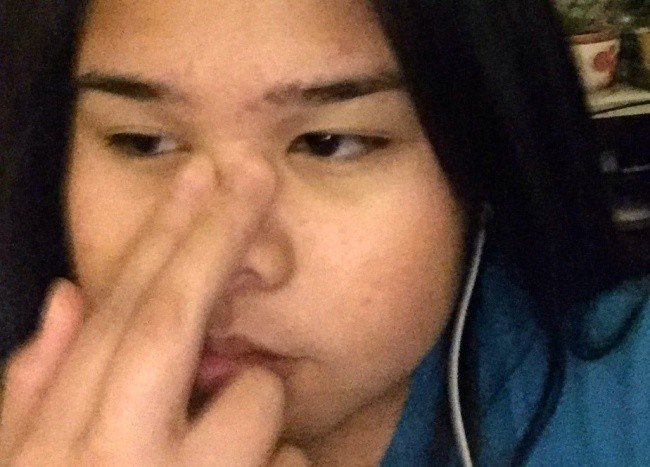
The image size is (650, 467). I want to click on headphone cord, so click(452, 359).